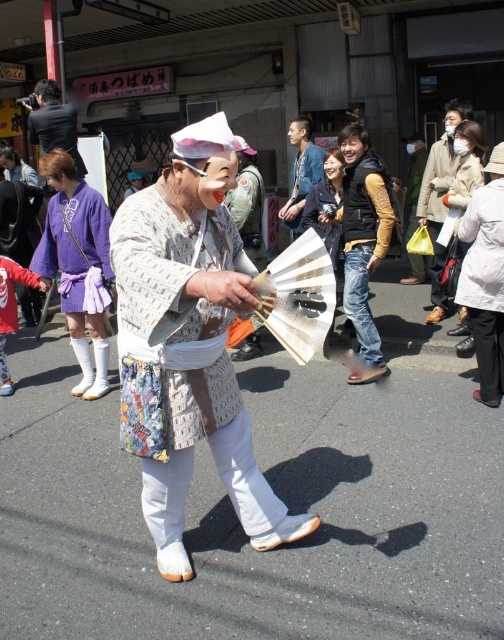
In the scene shown: Is purple fabric kimono at left to the right of denim jeans at center from the viewer's perspective?

No, purple fabric kimono at left is not to the right of denim jeans at center.

Is point (102, 385) positioned before point (384, 202)?

That is False.

I want to click on purple fabric kimono at left, so click(78, 264).

Who is taller, purple fabric kimono at left or matte white fan at center?

purple fabric kimono at left is taller.

Between point (103, 324) and point (346, 332), which one is positioned in front?

Positioned in front is point (103, 324).

This screenshot has height=640, width=504. I want to click on purple fabric kimono at left, so click(x=78, y=264).

Does white cotton kimono at center appear over purple fabric kimono at left?

Actually, white cotton kimono at center is below purple fabric kimono at left.

The height and width of the screenshot is (640, 504). I want to click on white cotton kimono at center, so click(189, 344).

What do you see at coordinates (189, 344) in the screenshot?
I see `white cotton kimono at center` at bounding box center [189, 344].

Where is `white cotton kimono at center`? white cotton kimono at center is located at coordinates (189, 344).